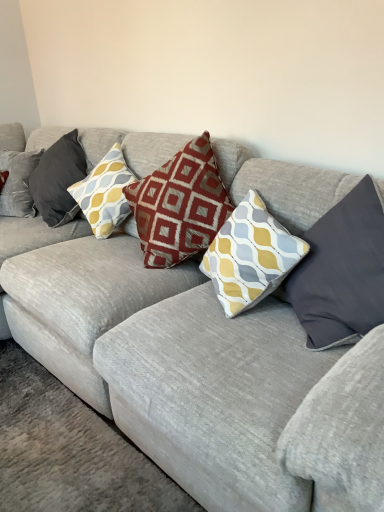
I want to click on maroon fabric pillow at center, marked as the third pillow in a left-to-right arrangement, so click(180, 205).

The height and width of the screenshot is (512, 384). What do you see at coordinates (105, 193) in the screenshot? I see `red textured pillow at center, the fourth pillow from the right` at bounding box center [105, 193].

Based on the photo, measure the distance between point (316, 223) and camera.

The depth of point (316, 223) is 1.42 meters.

Where is `maroon fabric pillow at center, marked as the third pillow in a left-to-right arrangement`? maroon fabric pillow at center, marked as the third pillow in a left-to-right arrangement is located at coordinates (180, 205).

Measure the distance between yellow and gray patterned pillow at center, the fourth pillow viewed from the left, and red textured pillow at center, the fourth pillow from the right.

yellow and gray patterned pillow at center, the fourth pillow viewed from the left, and red textured pillow at center, the fourth pillow from the right, are 29.00 inches apart from each other.

Looking at this image, is yellow and gray patterned pillow at center, the fourth pillow viewed from the left, beside red textured pillow at center, the fourth pillow from the right?

No, yellow and gray patterned pillow at center, the fourth pillow viewed from the left, is not next to red textured pillow at center, the fourth pillow from the right.

Which is more to the right, yellow and gray patterned pillow at center, positioned as the 2th pillow in right-to-left order, or red textured pillow at center, the fourth pillow from the right?

yellow and gray patterned pillow at center, positioned as the 2th pillow in right-to-left order.

Is red textured pillow at center, the fourth pillow from the right, located within yellow and gray patterned pillow at center, the fourth pillow viewed from the left?

Definitely not — red textured pillow at center, the fourth pillow from the right, is not inside yellow and gray patterned pillow at center, the fourth pillow viewed from the left.

Can you confirm if red textured pillow at center, the fourth pillow from the right, is positioned to the right of velvet cushion at left, the first pillow from the left?

Yes.

Considering the positions of points (95, 207) and (58, 149), is point (95, 207) closer to camera compared to point (58, 149)?

That is True.

Does red textured pillow at center, placed as the second pillow when sorted from left to right, have a greater height compared to velvet cushion at left, the 5th pillow from the right?

In fact, red textured pillow at center, placed as the second pillow when sorted from left to right, may be shorter than velvet cushion at left, the 5th pillow from the right.

Is red textured pillow at center, placed as the second pillow when sorted from left to right, next to velvet cushion at left, the 5th pillow from the right?

No, red textured pillow at center, placed as the second pillow when sorted from left to right, is not in contact with velvet cushion at left, the 5th pillow from the right.

Is velvet cushion at left, the 5th pillow from the right, aimed at red textured pillow at center, placed as the second pillow when sorted from left to right?

No, velvet cushion at left, the 5th pillow from the right, is not facing towards red textured pillow at center, placed as the second pillow when sorted from left to right.

Is velvet cushion at left, the first pillow from the left, spatially inside red textured pillow at center, the fourth pillow from the right, or outside of it?

velvet cushion at left, the first pillow from the left, is not inside red textured pillow at center, the fourth pillow from the right, it's outside.

From a real-world perspective, who is located higher, velvet cushion at left, the 5th pillow from the right, or red textured pillow at center, the fourth pillow from the right?

red textured pillow at center, the fourth pillow from the right.

Consider the image. Is maroon fabric pillow at center, marked as the third pillow in a left-to-right arrangement, in contact with yellow and gray patterned pillow at center, the fourth pillow viewed from the left?

They are not placed beside each other.

From the image's perspective, which one is positioned higher, maroon fabric pillow at center, marked as the third pillow in a right-to-left arrangement, or yellow and gray patterned pillow at center, the fourth pillow viewed from the left?

maroon fabric pillow at center, marked as the third pillow in a right-to-left arrangement, from the image's perspective.

Which object is further away from the camera, maroon fabric pillow at center, marked as the third pillow in a right-to-left arrangement, or yellow and gray patterned pillow at center, the fourth pillow viewed from the left?

maroon fabric pillow at center, marked as the third pillow in a right-to-left arrangement.

From a real-world perspective, is maroon fabric pillow at center, marked as the third pillow in a right-to-left arrangement, over yellow and gray patterned pillow at center, the fourth pillow viewed from the left?

Yes, from a real-world perspective, maroon fabric pillow at center, marked as the third pillow in a right-to-left arrangement, is above yellow and gray patterned pillow at center, the fourth pillow viewed from the left.

Can you confirm if velvet cushion at left, the 5th pillow from the right, is taller than maroon fabric pillow at center, marked as the third pillow in a right-to-left arrangement?

Incorrect, the height of velvet cushion at left, the 5th pillow from the right, is not larger of that of maroon fabric pillow at center, marked as the third pillow in a right-to-left arrangement.

How much distance is there between velvet cushion at left, the first pillow from the left, and maroon fabric pillow at center, marked as the third pillow in a right-to-left arrangement?

The distance of velvet cushion at left, the first pillow from the left, from maroon fabric pillow at center, marked as the third pillow in a right-to-left arrangement, is 26.33 inches.

Is velvet cushion at left, the first pillow from the left, positioned beyond the bounds of maroon fabric pillow at center, marked as the third pillow in a right-to-left arrangement?

Absolutely, velvet cushion at left, the first pillow from the left, is external to maroon fabric pillow at center, marked as the third pillow in a right-to-left arrangement.

Which is behind, point (60, 209) or point (177, 177)?

Positioned behind is point (60, 209).

Considering the relative sizes of velvet cushion at left, the first pillow from the left, and yellow and gray patterned pillow at center, positioned as the 2th pillow in right-to-left order, in the image provided, is velvet cushion at left, the first pillow from the left, taller than yellow and gray patterned pillow at center, positioned as the 2th pillow in right-to-left order,?

Correct, velvet cushion at left, the first pillow from the left, is much taller as yellow and gray patterned pillow at center, positioned as the 2th pillow in right-to-left order.

Looking at this image, is velvet cushion at left, the first pillow from the left, positioned with its back to yellow and gray patterned pillow at center, the fourth pillow viewed from the left?

No, yellow and gray patterned pillow at center, the fourth pillow viewed from the left, is not at the back of velvet cushion at left, the first pillow from the left.

You are a GUI agent. You are given a task and a screenshot of the screen. Output one action in this format:
    pyautogui.click(x=<x>, y=<y>)
    Task: Click on the 3rd pillow to the left when counting from the yellow and gray patterned pillow at center, positioned as the 2th pillow in right-to-left order
    The image size is (384, 512).
    Given the screenshot: What is the action you would take?
    pyautogui.click(x=58, y=180)

Based on the photo, is red textured pillow at center, placed as the second pillow when sorted from left to right, taller or shorter than yellow and gray patterned pillow at center, positioned as the 2th pillow in right-to-left order?

Considering their sizes, red textured pillow at center, placed as the second pillow when sorted from left to right, has more height than yellow and gray patterned pillow at center, positioned as the 2th pillow in right-to-left order.

Does red textured pillow at center, the fourth pillow from the right, turn towards yellow and gray patterned pillow at center, the fourth pillow viewed from the left?

No, red textured pillow at center, the fourth pillow from the right, is not aimed at yellow and gray patterned pillow at center, the fourth pillow viewed from the left.

From a real-world perspective, is red textured pillow at center, the fourth pillow from the right, under yellow and gray patterned pillow at center, positioned as the 2th pillow in right-to-left order?

No, from a real-world perspective, red textured pillow at center, the fourth pillow from the right, is not below yellow and gray patterned pillow at center, positioned as the 2th pillow in right-to-left order.

Find the location of `the 2nd pillow directly beneath the red textured pillow at center, placed as the second pillow when sorted from left to right (from a real-world perspective)`. the 2nd pillow directly beneath the red textured pillow at center, placed as the second pillow when sorted from left to right (from a real-world perspective) is located at coordinates (250, 256).

The image size is (384, 512). What are the coordinates of `pillow that is the 1st object located in front of the velvet cushion at left, the first pillow from the left` in the screenshot? It's located at (105, 193).

When comparing their distances from red textured pillow at center, the fourth pillow from the right, does dark gray fabric pillow at right, the 1th pillow when ordered from right to left, or yellow and gray patterned pillow at center, positioned as the 2th pillow in right-to-left order, seem closer?

Based on the image, yellow and gray patterned pillow at center, positioned as the 2th pillow in right-to-left order, appears to be nearer to red textured pillow at center, the fourth pillow from the right.

Considering their positions, is velvet cushion at left, the 5th pillow from the right, positioned further to dark gray fabric pillow at right, the 5th pillow in the left-to-right sequence, than red textured pillow at center, placed as the second pillow when sorted from left to right?

The object further to dark gray fabric pillow at right, the 5th pillow in the left-to-right sequence, is velvet cushion at left, the 5th pillow from the right.

Which object lies nearer to the anchor point velvet cushion at left, the 5th pillow from the right, dark gray fabric pillow at right, the 1th pillow when ordered from right to left, or yellow and gray patterned pillow at center, the fourth pillow viewed from the left?

Among the two, yellow and gray patterned pillow at center, the fourth pillow viewed from the left, is located nearer to velvet cushion at left, the 5th pillow from the right.

Which object lies nearer to the anchor point dark gray fabric pillow at right, the 1th pillow when ordered from right to left, velvet cushion at left, the 5th pillow from the right, or maroon fabric pillow at center, marked as the third pillow in a left-to-right arrangement?

The object closer to dark gray fabric pillow at right, the 1th pillow when ordered from right to left, is maroon fabric pillow at center, marked as the third pillow in a left-to-right arrangement.

Which object lies further to the anchor point yellow and gray patterned pillow at center, the fourth pillow viewed from the left, dark gray fabric pillow at right, the 1th pillow when ordered from right to left, or red textured pillow at center, the fourth pillow from the right?

red textured pillow at center, the fourth pillow from the right.

From the image, which object appears to be farther from yellow and gray patterned pillow at center, positioned as the 2th pillow in right-to-left order, dark gray fabric pillow at right, the 1th pillow when ordered from right to left, or velvet cushion at left, the first pillow from the left?

velvet cushion at left, the first pillow from the left, is positioned further to the anchor yellow and gray patterned pillow at center, positioned as the 2th pillow in right-to-left order.

Considering their positions, is maroon fabric pillow at center, marked as the third pillow in a right-to-left arrangement, positioned further to velvet cushion at left, the first pillow from the left, than yellow and gray patterned pillow at center, positioned as the 2th pillow in right-to-left order?

yellow and gray patterned pillow at center, positioned as the 2th pillow in right-to-left order, is further to velvet cushion at left, the first pillow from the left.

Considering their positions, is dark gray fabric pillow at right, the 1th pillow when ordered from right to left, positioned closer to velvet cushion at left, the 5th pillow from the right, than maroon fabric pillow at center, marked as the third pillow in a right-to-left arrangement?

The object closer to velvet cushion at left, the 5th pillow from the right, is maroon fabric pillow at center, marked as the third pillow in a right-to-left arrangement.

Where is `pillow located between maroon fabric pillow at center, marked as the third pillow in a left-to-right arrangement, and dark gray fabric pillow at right, the 1th pillow when ordered from right to left, in the left-right direction`? The image size is (384, 512). pillow located between maroon fabric pillow at center, marked as the third pillow in a left-to-right arrangement, and dark gray fabric pillow at right, the 1th pillow when ordered from right to left, in the left-right direction is located at coordinates (250, 256).

This screenshot has height=512, width=384. I want to click on pillow situated between velvet cushion at left, the first pillow from the left, and maroon fabric pillow at center, marked as the third pillow in a left-to-right arrangement, from left to right, so click(105, 193).

Where is `pillow located between red textured pillow at center, placed as the second pillow when sorted from left to right, and yellow and gray patterned pillow at center, the fourth pillow viewed from the left, in the left-right direction`? pillow located between red textured pillow at center, placed as the second pillow when sorted from left to right, and yellow and gray patterned pillow at center, the fourth pillow viewed from the left, in the left-right direction is located at coordinates (180, 205).